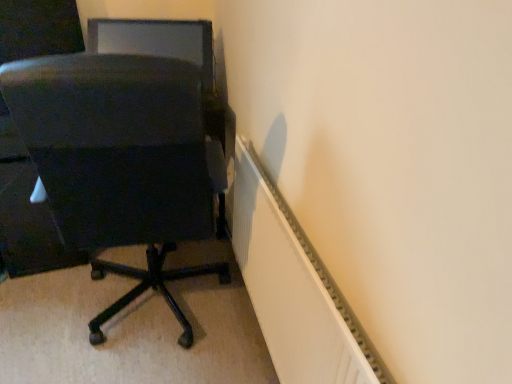
Question: Is matte black chair at left facing away from matte black monitor at upper left?

Choices:
 (A) yes
 (B) no

Answer: (B)

Question: From a real-world perspective, is matte black chair at left positioned over matte black monitor at upper left based on gravity?

Choices:
 (A) yes
 (B) no

Answer: (B)

Question: Is matte black chair at left bigger than matte black monitor at upper left?

Choices:
 (A) no
 (B) yes

Answer: (B)

Question: From a real-world perspective, is matte black chair at left located beneath matte black monitor at upper left?

Choices:
 (A) no
 (B) yes

Answer: (B)

Question: Is matte black chair at left not inside matte black monitor at upper left?

Choices:
 (A) no
 (B) yes

Answer: (B)

Question: Considering their positions, is matte black chair at left located in front of or behind white ribbed radiator at lower right?

Choices:
 (A) behind
 (B) front

Answer: (A)

Question: From the image's perspective, is matte black chair at left positioned above or below white ribbed radiator at lower right?

Choices:
 (A) below
 (B) above

Answer: (B)

Question: Considering the positions of matte black chair at left and white ribbed radiator at lower right in the image, is matte black chair at left bigger or smaller than white ribbed radiator at lower right?

Choices:
 (A) big
 (B) small

Answer: (A)

Question: Looking at their shapes, would you say matte black chair at left is wider or thinner than white ribbed radiator at lower right?

Choices:
 (A) thin
 (B) wide

Answer: (B)

Question: Which is correct: white ribbed radiator at lower right is inside matte black monitor at upper left, or outside of it?

Choices:
 (A) outside
 (B) inside

Answer: (A)

Question: Based on their sizes in the image, would you say white ribbed radiator at lower right is bigger or smaller than matte black monitor at upper left?

Choices:
 (A) big
 (B) small

Answer: (A)

Question: In terms of width, does white ribbed radiator at lower right look wider or thinner when compared to matte black monitor at upper left?

Choices:
 (A) thin
 (B) wide

Answer: (A)

Question: From a real-world perspective, relative to matte black monitor at upper left, is white ribbed radiator at lower right vertically above or below?

Choices:
 (A) below
 (B) above

Answer: (A)

Question: From the image's perspective, relative to matte black chair at left, is white ribbed radiator at lower right above or below?

Choices:
 (A) above
 (B) below

Answer: (B)

Question: In terms of size, does white ribbed radiator at lower right appear bigger or smaller than matte black chair at left?

Choices:
 (A) small
 (B) big

Answer: (A)